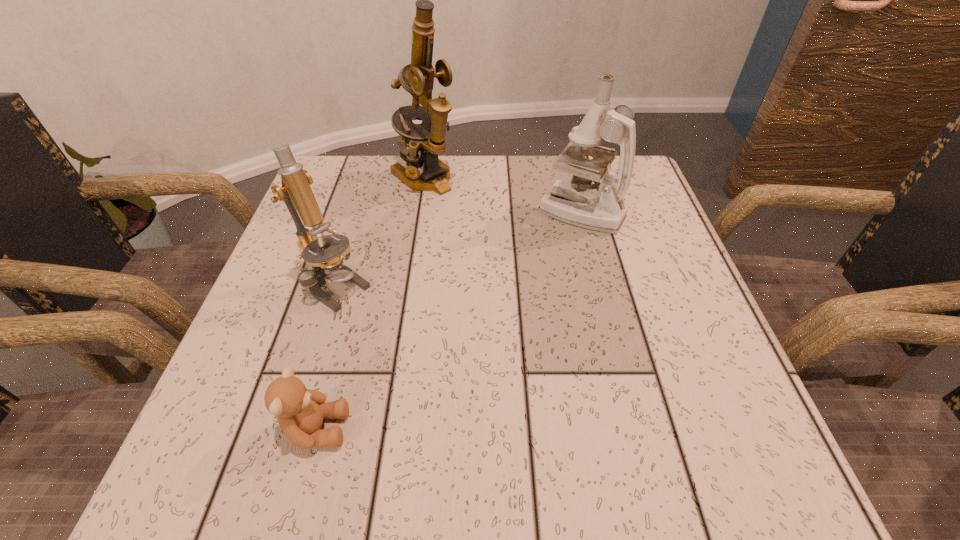
Locate an element on the screen. vacant space that's between the shortest object and the rightmost microscope is located at coordinates (448, 320).

Select which object appears as the third closest to the nearest object. Please provide its 2D coordinates. Your answer should be formatted as a tuple, i.e. [(x, y)], where the tuple contains the x and y coordinates of a point satisfying the conditions above.

[(417, 78)]

Where is `the third closest object relative to the rightmost microscope`? The image size is (960, 540). the third closest object relative to the rightmost microscope is located at coordinates (300, 411).

Point out which microscope is positioned as the nearest to the third farthest object. Please provide its 2D coordinates. Your answer should be formatted as a tuple, i.e. [(x, y)], where the tuple contains the x and y coordinates of a point satisfying the conditions above.

[(417, 78)]

Find the location of a particular element. The height and width of the screenshot is (540, 960). microscope that is the second nearest to the tallest object is located at coordinates (327, 264).

The width and height of the screenshot is (960, 540). In order to click on vacant space that satisfies the following two spatial constraints: 1. on the back side of the second nearest object; 2. on the left side of the tallest microscope in this screenshot , I will do `click(371, 177)`.

Locate an element on the screen. free point that satisfies the following two spatial constraints: 1. on the back side of the nearest microscope; 2. on the right side of the tallest microscope is located at coordinates (371, 177).

Identify the location of blank area in the image that satisfies the following two spatial constraints: 1. on the front side of the rightmost microscope; 2. on the front-facing side of the shortest object. (636, 429).